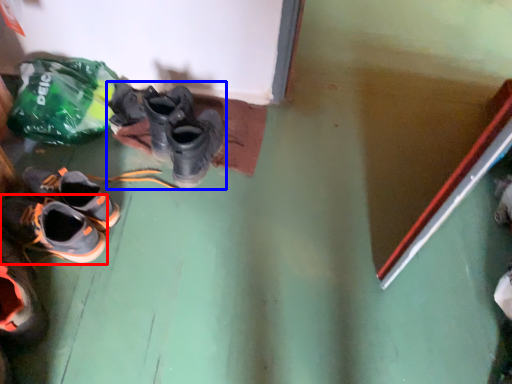
Question: Which point is closer to the camera, shoe (highlighted by a red box) or footwear (highlighted by a blue box)?

Choices:
 (A) shoe
 (B) footwear

Answer: (A)